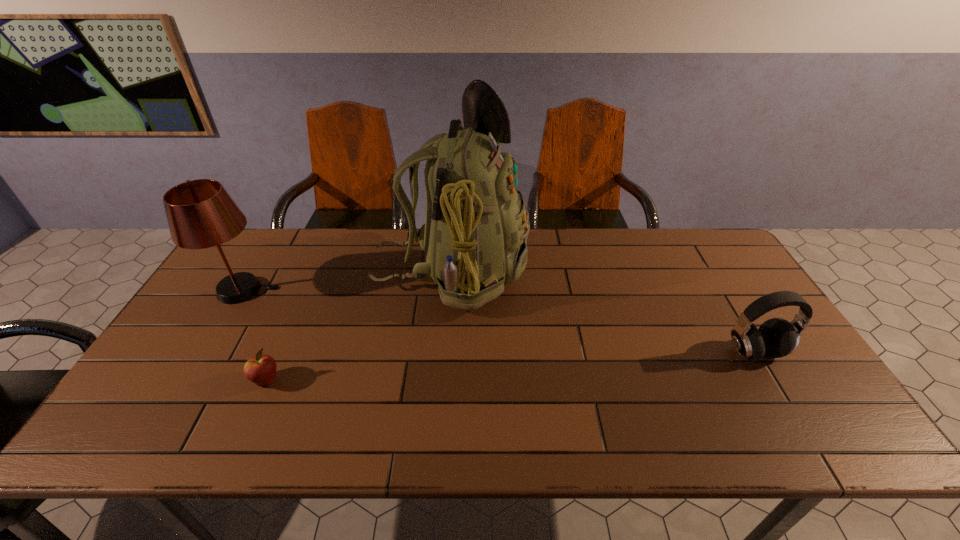
Where is `unoccupied area between the third object from left to right and the second tallest object`? unoccupied area between the third object from left to right and the second tallest object is located at coordinates (347, 281).

This screenshot has width=960, height=540. I want to click on empty space between the backpack and the nearest object, so click(x=358, y=327).

Locate an element on the screen. object identified as the closest to the second tallest object is located at coordinates (261, 369).

Locate which object is the closest to the leftmost object. Please provide its 2D coordinates. Your answer should be formatted as a tuple, i.e. [(x, y)], where the tuple contains the x and y coordinates of a point satisfying the conditions above.

[(261, 369)]

Locate an element on the screen. The width and height of the screenshot is (960, 540). free space that satisfies the following two spatial constraints: 1. on the front-facing side of the shortest object; 2. on the left side of the leftmost object is located at coordinates (188, 381).

Find the location of a particular element. This screenshot has height=540, width=960. vacant space that satisfies the following two spatial constraints: 1. on the front-facing side of the apple; 2. on the right side of the second tallest object is located at coordinates (188, 381).